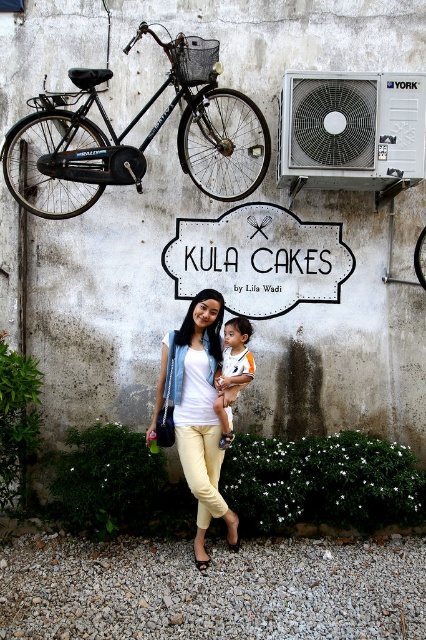
Question: Which object appears farthest from the camera in this image?

Choices:
 (A) white paper sign at center
 (B) silver metallic air conditioner at upper right
 (C) white cotton shirt at center

Answer: (A)

Question: Does black matte bicycle at upper left come in front of white cotton shirt at center?

Choices:
 (A) no
 (B) yes

Answer: (A)

Question: Among these points, which one is farthest from the camera?

Choices:
 (A) (247, 250)
 (B) (187, 76)
 (C) (371, 132)

Answer: (A)

Question: Does black matte bicycle at upper left lie in front of white cotton shirt at center?

Choices:
 (A) yes
 (B) no

Answer: (B)

Question: Does white paper sign at center appear on the left side of light yellow denim pants at center?

Choices:
 (A) yes
 (B) no

Answer: (B)

Question: Which of the following is the closest to the observer?

Choices:
 (A) silver metallic air conditioner at upper right
 (B) light yellow denim pants at center

Answer: (B)